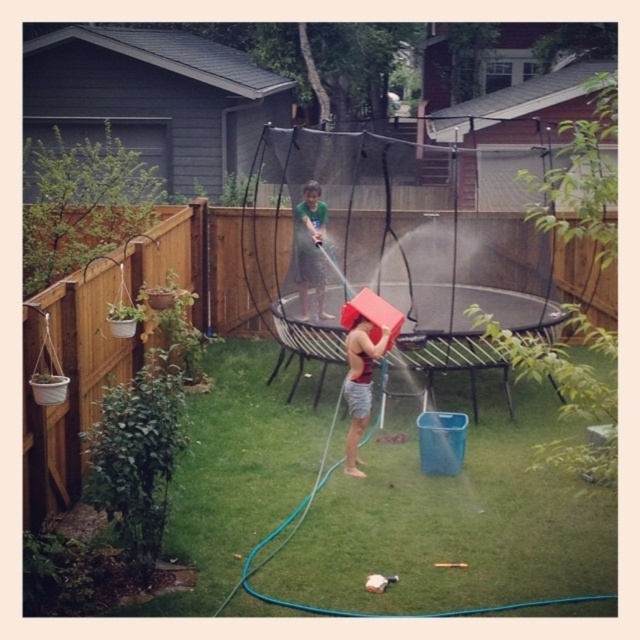
Is point (356, 323) closer to viewer compared to point (317, 280)?

Yes.

Does matte red bucket at center come in front of green fabric shirt at center?

Yes, matte red bucket at center is closer to the viewer.

Measure the distance between matte red bucket at center and camera.

A distance of 6.35 meters exists between matte red bucket at center and camera.

Where is `matte red bucket at center`? matte red bucket at center is located at coordinates (358, 384).